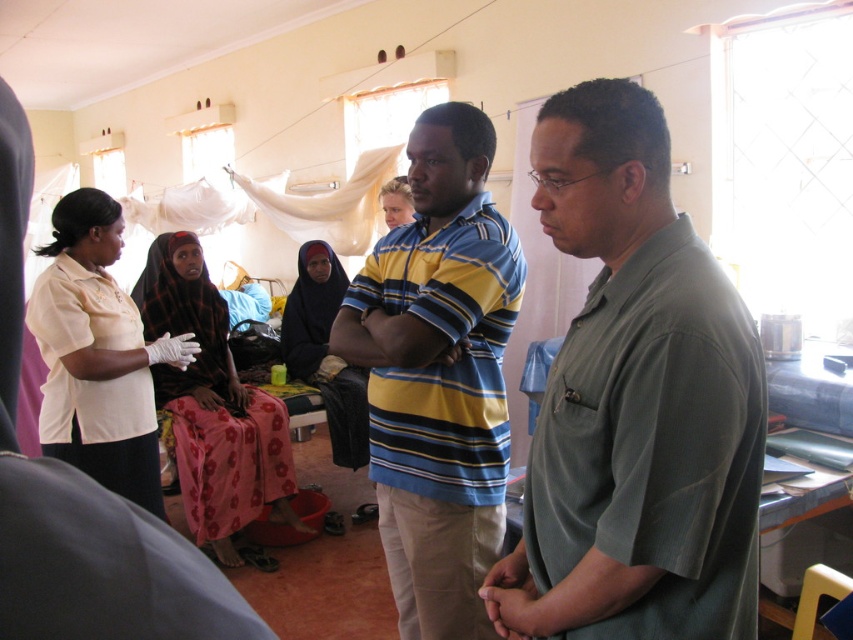
Is green matte shirt at center to the left of striped cotton shirt at center from the viewer's perspective?

Incorrect, green matte shirt at center is not on the left side of striped cotton shirt at center.

Describe the element at coordinates (635, 403) in the screenshot. This screenshot has height=640, width=853. I see `green matte shirt at center` at that location.

Is point (650, 461) behind point (494, 634)?

No, (650, 461) is in front of (494, 634).

Image resolution: width=853 pixels, height=640 pixels. Identify the location of green matte shirt at center. (635, 403).

Is matte white shirt at left wider than black fabric dress at center?

No.

Is matte white shirt at left above black fabric dress at center?

Yes, matte white shirt at left is above black fabric dress at center.

Where is `matte white shirt at left`? matte white shirt at left is located at coordinates (97, 355).

Locate an element on the screen. matte white shirt at left is located at coordinates (97, 355).

Is point (669, 284) behind point (202, 492)?

No, it is not.

Is point (757, 499) farther from camera compared to point (222, 301)?

No, it is in front of (222, 301).

Where is `green matte shirt at center`? green matte shirt at center is located at coordinates (635, 403).